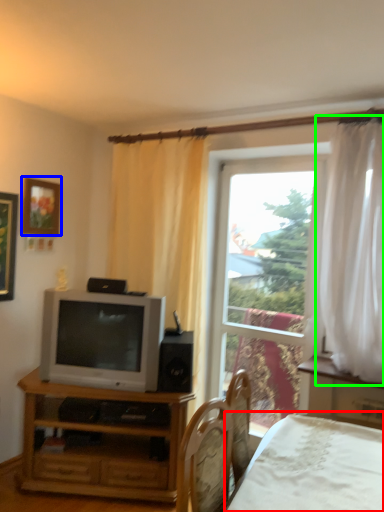
Question: Considering the real-world distances, which object is farthest from bed (highlighted by a red box)? picture frame (highlighted by a blue box) or curtain (highlighted by a green box)?

Choices:
 (A) picture frame
 (B) curtain

Answer: (A)